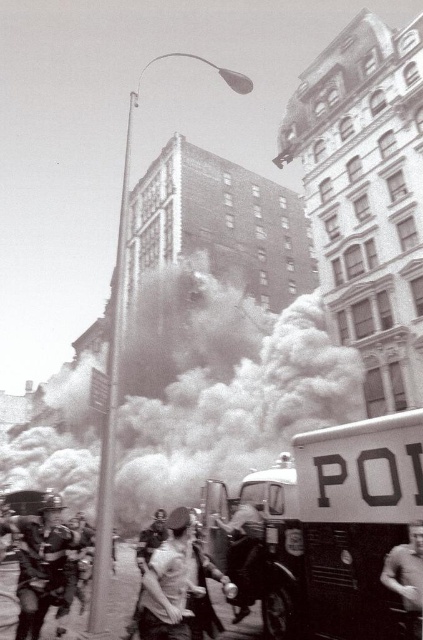
Question: Is foggy white smoke at center to the left of white matte police vehicle at center-right from the viewer's perspective?

Choices:
 (A) yes
 (B) no

Answer: (A)

Question: Which point appears farthest from the camera in this image?

Choices:
 (A) (186, 589)
 (B) (21, 573)
 (C) (236, 561)
 (D) (401, 557)

Answer: (B)

Question: Considering the real-world distances, which object is farthest from the metallic helmet at center?

Choices:
 (A) smooth leather jacket at center
 (B) skinny white shirt at center
 (C) white matte police vehicle at center-right
 (D) foggy white smoke at center

Answer: (D)

Question: Is metallic helmet at center to the right of smooth skin person at center from the viewer's perspective?

Choices:
 (A) no
 (B) yes

Answer: (A)

Question: Among these objects, which one is nearest to the camera?

Choices:
 (A) foggy white smoke at center
 (B) skinny white shirt at center

Answer: (B)

Question: Does metallic helmet at center appear over skinny white shirt at center?

Choices:
 (A) no
 (B) yes

Answer: (A)